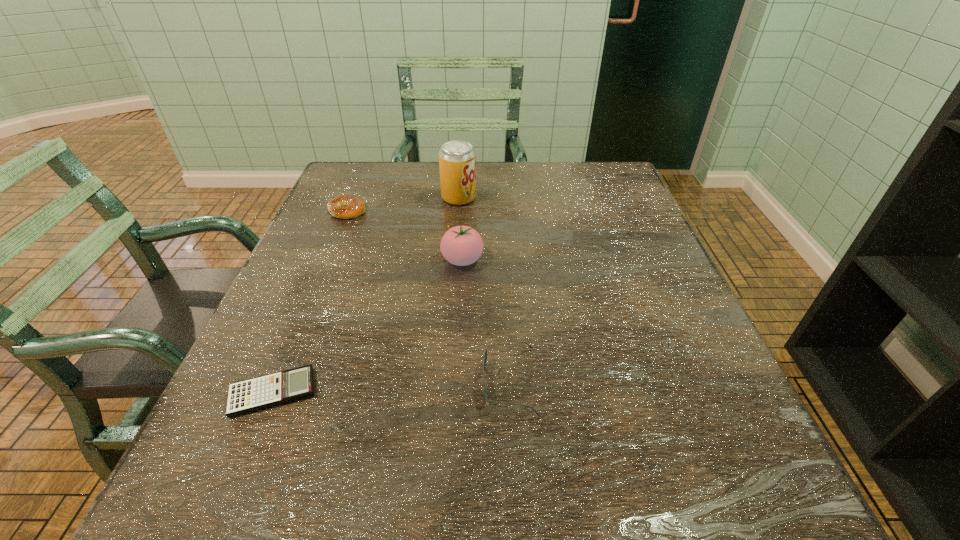
In the image, there is a desktop. Identify the location of free space at the left edge. (343, 269).

Identify the location of vacant space at the right edge of the desktop. The image size is (960, 540). (x=601, y=205).

Image resolution: width=960 pixels, height=540 pixels. In order to click on free space that is in between the third tallest object and the tomato in this screenshot , I will do `click(486, 321)`.

Find the location of a particular element. vacant area that lies between the shortest object and the second shortest object is located at coordinates (310, 301).

This screenshot has width=960, height=540. I want to click on vacant space that's between the tomato and the third tallest object, so click(486, 321).

Find the location of a particular element. This screenshot has width=960, height=540. free space between the shortest object and the second tallest object is located at coordinates (368, 326).

This screenshot has width=960, height=540. I want to click on free spot between the calculator and the third tallest object, so click(392, 387).

At what (x,y) coordinates should I click in order to perform the action: click on empty space that is in between the calculator and the second tallest object. Please return your answer as a coordinate pair (x, y). The width and height of the screenshot is (960, 540). Looking at the image, I should click on (368, 326).

Where is `free space between the calculator and the pop (soda)`? Image resolution: width=960 pixels, height=540 pixels. free space between the calculator and the pop (soda) is located at coordinates (366, 295).

Locate which object is the second closest to the bagel. Please provide its 2D coordinates. Your answer should be formatted as a tuple, i.e. [(x, y)], where the tuple contains the x and y coordinates of a point satisfying the conditions above.

[(461, 245)]